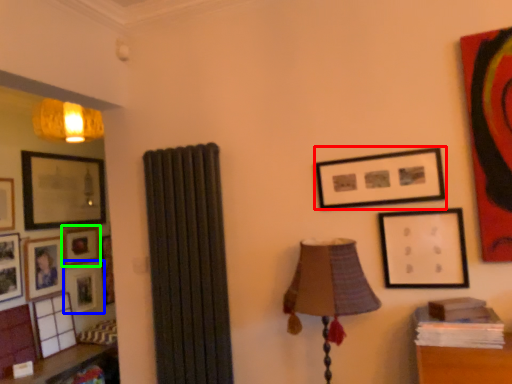
Question: Estimate the real-world distances between objects in this image. Which object is farther from picture frame (highlighted by a red box), picture frame (highlighted by a blue box) or picture frame (highlighted by a green box)?

Choices:
 (A) picture frame
 (B) picture frame

Answer: (A)